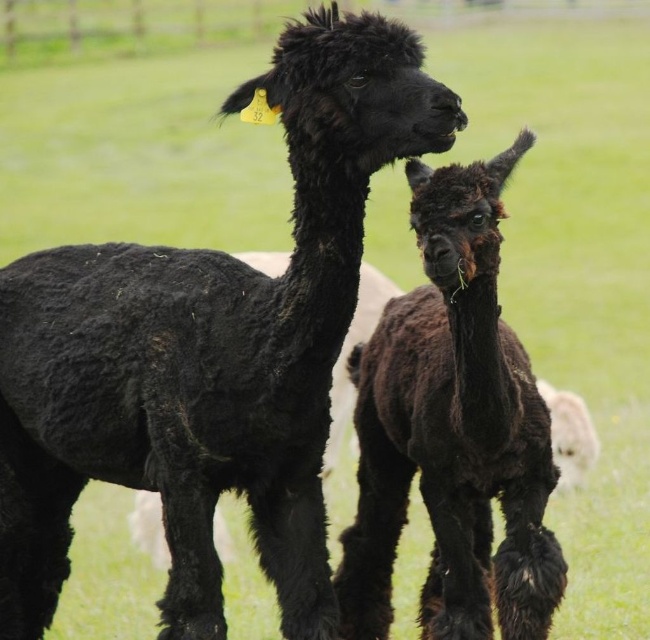
You are standing in the middle of the field and notice two points marked in the image. Which point is closer to you, point (151, 374) or point (384, 364)?

Point (151, 374) is in front of point (384, 364), so it is closer to you.

You are a farmer who needs to separate two alpacas using a fence. The fence can only be placed between the black woolly alpaca at left and the shiny black alpaca at center. Given that the minimum distance required between the fence and each alpaca is 10 inches, is this possible?

The distance between the black woolly alpaca at left and the shiny black alpaca at center is 21.01 inches. Since the minimum required distance from each alpaca to the fence is 10 inches, adding both sides gives 20 inches. The total distance of 21.01 inches is sufficient, so yes, the fence can be placed between them with the required spacing.

You need to determine which alpaca has a wider body. You see the black woolly alpaca at left and the shiny black alpaca at center. Which one is wider?

The black woolly alpaca at left is wider than the shiny black alpaca at center.